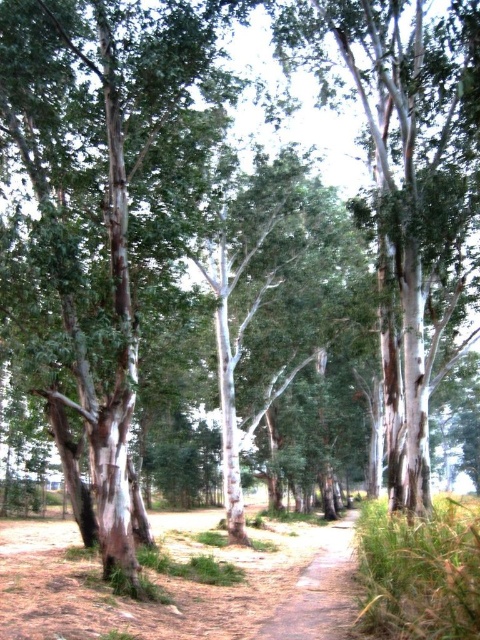
Does white bark tree at center appear on the right side of brown dirt track at center?

Indeed, white bark tree at center is positioned on the right side of brown dirt track at center.

The width and height of the screenshot is (480, 640). Find the location of `white bark tree at center`. white bark tree at center is located at coordinates (408, 168).

The image size is (480, 640). In order to click on white bark tree at center in this screenshot , I will do `click(408, 168)`.

Which is below, brown dirt track at center or dirt path at center?

brown dirt track at center is below.

Does brown dirt track at center appear over dirt path at center?

Actually, brown dirt track at center is below dirt path at center.

The height and width of the screenshot is (640, 480). What do you see at coordinates (181, 584) in the screenshot?
I see `brown dirt track at center` at bounding box center [181, 584].

Find the location of `brown dirt track at center`. brown dirt track at center is located at coordinates (181, 584).

Who is positioned more to the right, white bark tree at center or dirt path at center?

white bark tree at center

Is point (414, 378) positioned behind point (352, 573)?

No, it is not.

The image size is (480, 640). Find the location of `white bark tree at center`. white bark tree at center is located at coordinates (408, 168).

You are a GUI agent. You are given a task and a screenshot of the screen. Output one action in this format:
    pyautogui.click(x=<x>, y=<y>)
    Task: Click on the white bark tree at center
    
    Given the screenshot: What is the action you would take?
    pyautogui.click(x=408, y=168)